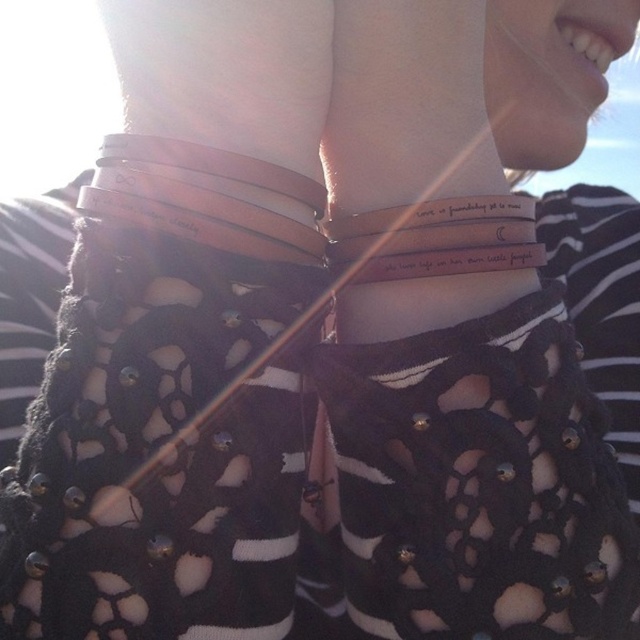
In the scene shown: How far apart are brown leather bracelets at center and white leather bracelet at center?

brown leather bracelets at center and white leather bracelet at center are 5.74 inches apart from each other.

Does brown leather bracelets at center appear on the right side of white leather bracelet at center?

Correct, you'll find brown leather bracelets at center to the right of white leather bracelet at center.

The image size is (640, 640). I want to click on brown leather bracelets at center, so click(x=493, y=452).